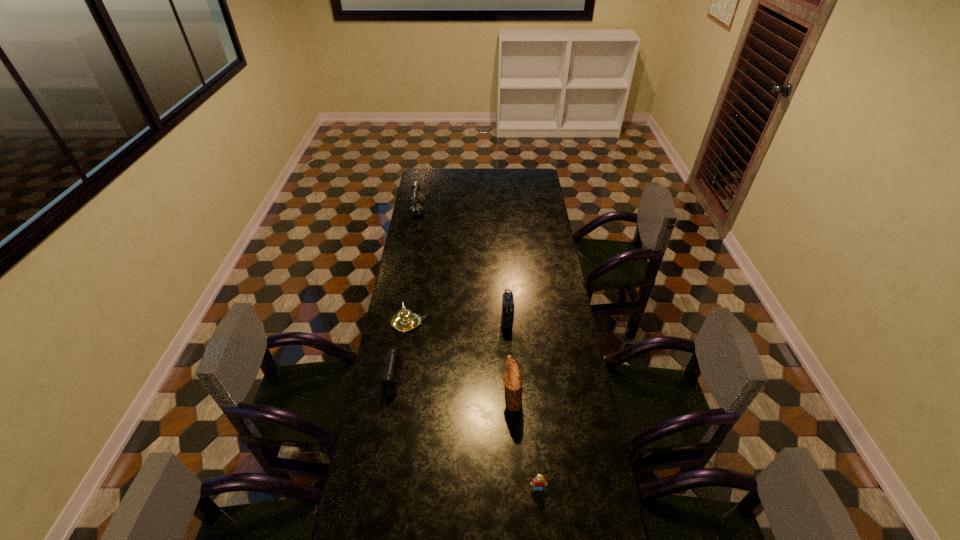
Where is `blank space located 0.070m on the front-facing side of the nearest object`? The height and width of the screenshot is (540, 960). blank space located 0.070m on the front-facing side of the nearest object is located at coordinates point(540,515).

The image size is (960, 540). In order to click on earphone at the left edge in this screenshot , I will do `click(416, 208)`.

Locate an element on the screen. This screenshot has width=960, height=540. candle holder that is positioned at the left edge is located at coordinates (404, 321).

The width and height of the screenshot is (960, 540). I want to click on clutch bag located at the left edge, so click(391, 370).

Locate an element on the screen. The width and height of the screenshot is (960, 540). vacant area at the far edge of the desktop is located at coordinates [x=457, y=181].

In the image, there is a desktop. Where is `vacant space at the left edge`? vacant space at the left edge is located at coordinates click(x=398, y=277).

This screenshot has height=540, width=960. I want to click on free space at the right edge of the desktop, so click(x=553, y=325).

Identify the location of vacant region at the far left corner. (441, 175).

Find the location of a particular element. The height and width of the screenshot is (540, 960). vacant space at the far right corner is located at coordinates (539, 170).

This screenshot has width=960, height=540. I want to click on vacant space in between the shortest clutch bag and the candle holder, so click(x=402, y=351).